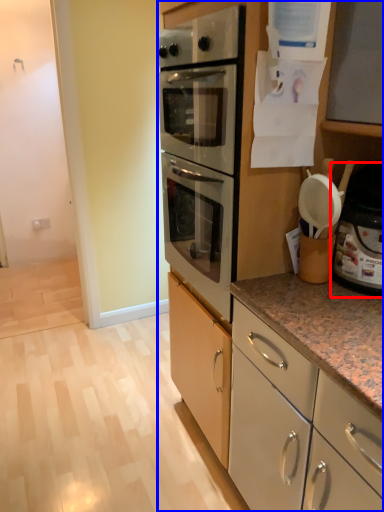
Question: Which object appears farthest to the camera in this image, appliance (highlighted by a red box) or cabinetry (highlighted by a blue box)?

Choices:
 (A) appliance
 (B) cabinetry

Answer: (A)